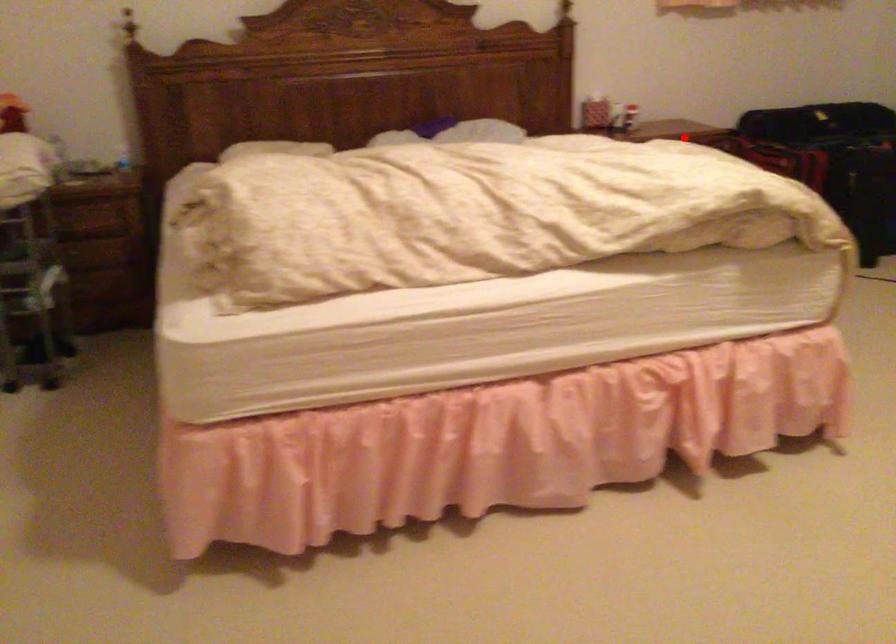
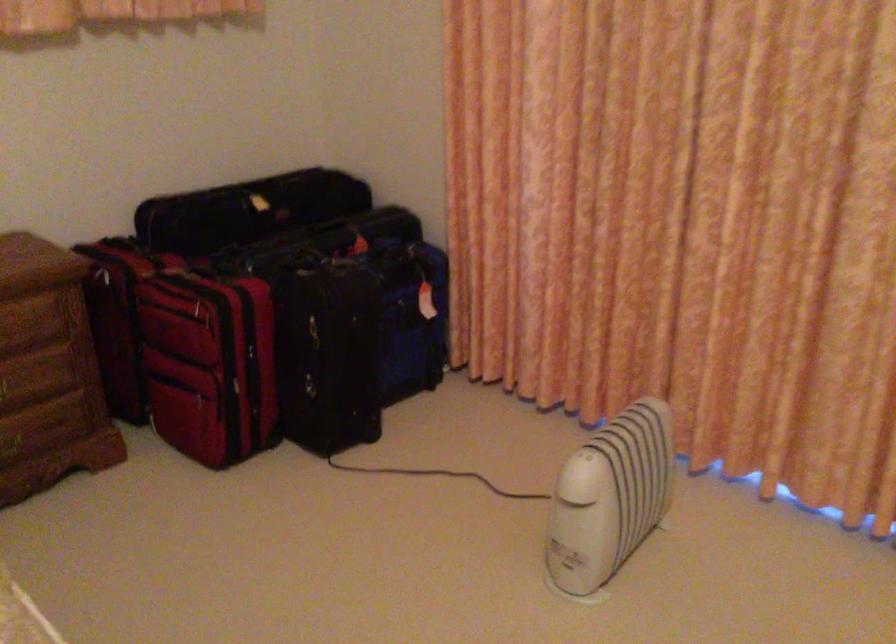
The point at the highlighted location is marked in the first image. Where is the corresponding point in the second image?

(14, 319)